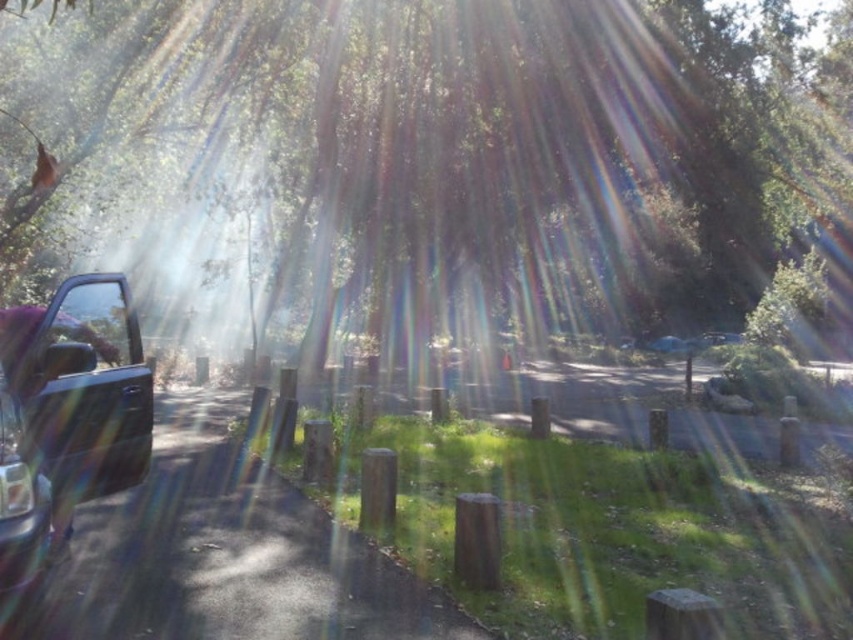
You are standing on the paved road and want to take a photo of the green leafy tree at left and the clear glass window at left. Which object will appear wider in the photo?

The green leafy tree at left will appear wider in the photo because its width is larger than the clear glass window at left.

You are a pedestrian standing on the road and see the shiny metallic truck at left and the clear glass window at left. Which object is closer to you?

The shiny metallic truck at left is closer to you because it is positioned under the clear glass window at left, meaning it is in front of the window.